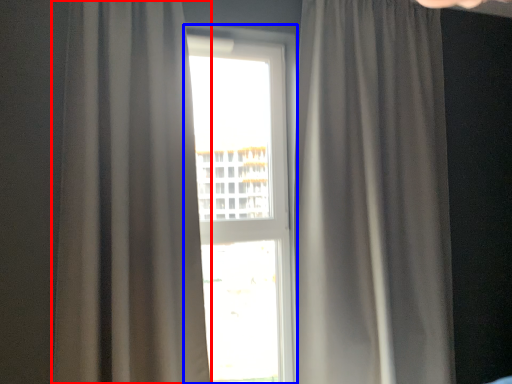
Question: Which of the following is the farthest to the observer, curtain (highlighted by a red box) or window (highlighted by a blue box)?

Choices:
 (A) curtain
 (B) window

Answer: (B)